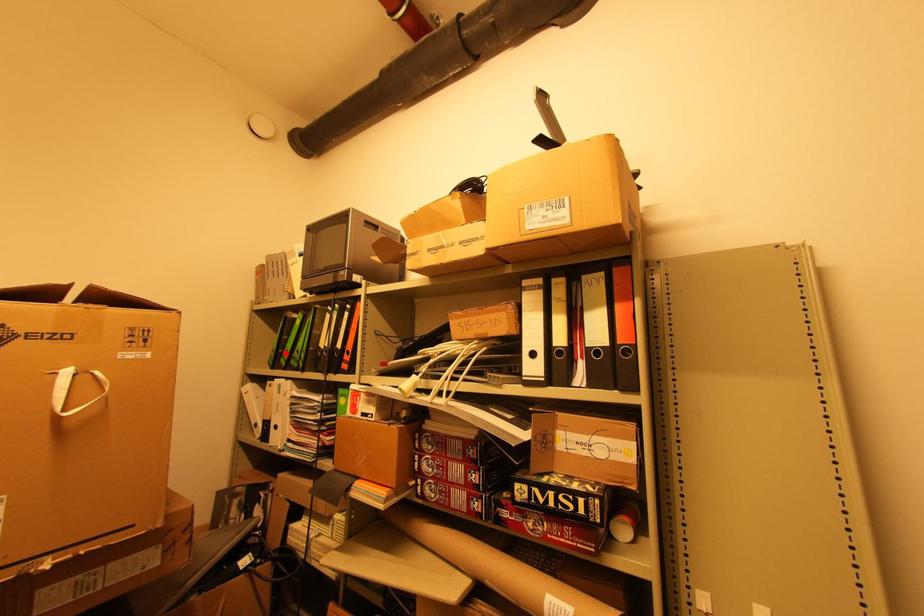
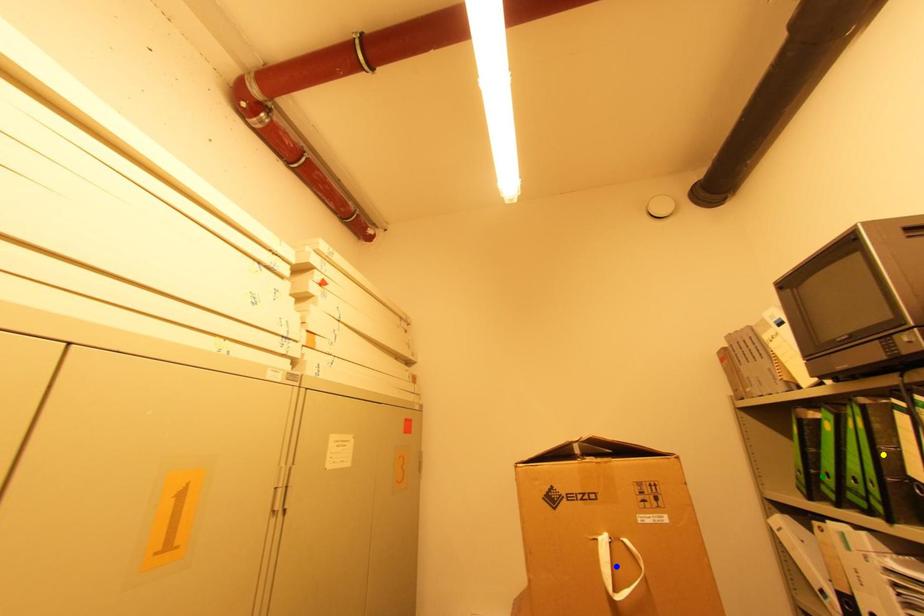
Question: I am providing you with two images of the same scene from different viewpoints. A red point is marked on the first image. You are given multiple points on the second image. Which point in image 2 is actually the same real-world point as the red point in image 1?

Choices:
 (A) yellow point
 (B) green point
 (C) blue point

Answer: (B)